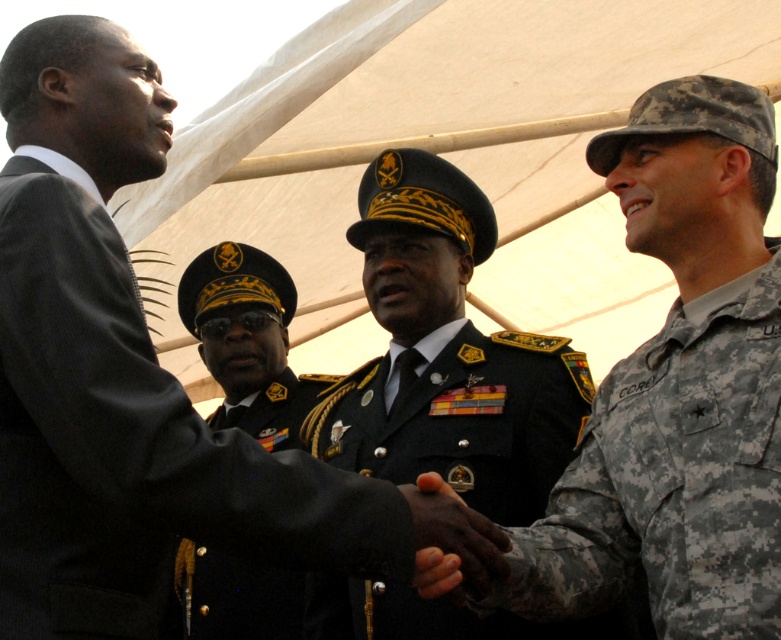
Between dark gray suit at left and black/golden-metallic military uniform at center, which one has less height?

Standing shorter between the two is black/golden-metallic military uniform at center.

Who is more forward, (13, 364) or (515, 449)?

Positioned in front is point (13, 364).

I want to click on dark gray suit at left, so click(123, 378).

Is dark gray suit at left shorter than dark skin/dryhand at center?

Incorrect, dark gray suit at left's height does not fall short of dark skin/dryhand at center's.

Where is `dark gray suit at left`? Image resolution: width=781 pixels, height=640 pixels. dark gray suit at left is located at coordinates (123, 378).

Does point (48, 435) come behind point (439, 528)?

No, (48, 435) is closer to viewer.

This screenshot has width=781, height=640. I want to click on dark gray suit at left, so click(123, 378).

Is camouflage uniform at right shorter than black uniform at center?

No.

Which is above, camouflage uniform at right or black uniform at center?

camouflage uniform at right is higher up.

Between point (560, 563) and point (191, 570), which one is positioned in front?

Positioned in front is point (560, 563).

Where is `camouflage uniform at right`? camouflage uniform at right is located at coordinates (679, 388).